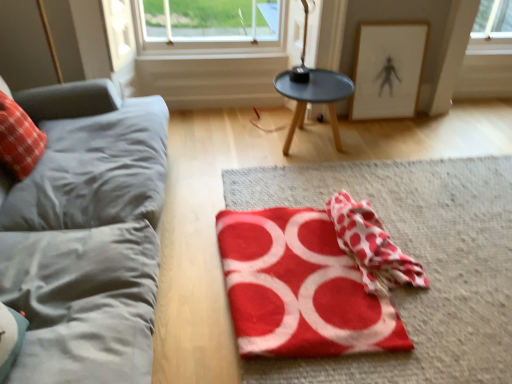
This screenshot has width=512, height=384. I want to click on unoccupied region to the right of black matte table at center, so click(371, 143).